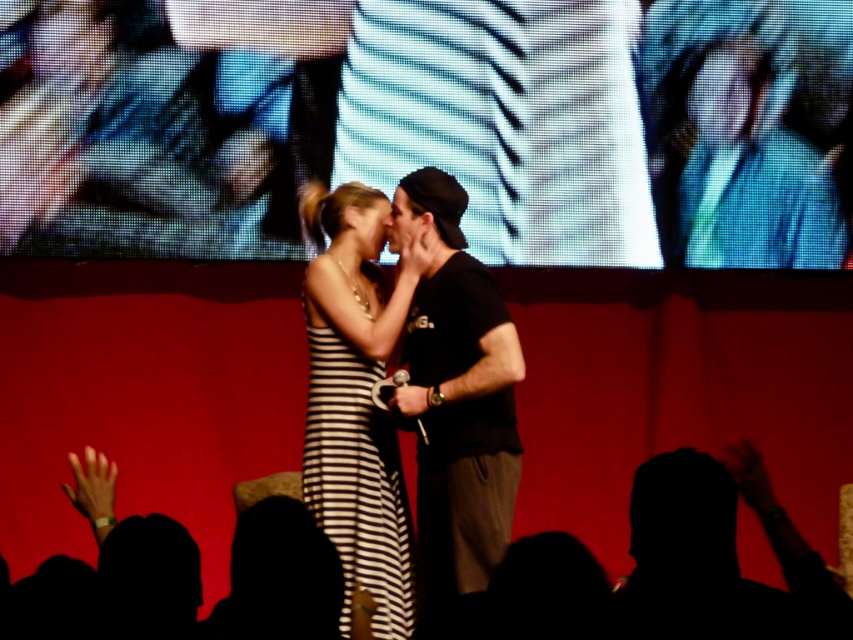
Between black cotton t-shirt at center and matte black hair at center, which one appears on the left side from the viewer's perspective?

matte black hair at center

Is black cotton t-shirt at center closer to the viewer compared to matte black hair at center?

That is True.

Does point (456, 376) come behind point (424, 221)?

No, (456, 376) is in front of (424, 221).

What are the coordinates of `black cotton t-shirt at center` in the screenshot? It's located at (457, 403).

Identify the location of matte black face at center. tap(369, 227).

Between matte black face at center and matte black hair at center, which one appears on the left side from the viewer's perspective?

Positioned to the left is matte black face at center.

Identify the location of matte black face at center. (369, 227).

Image resolution: width=853 pixels, height=640 pixels. In order to click on matte black face at center in this screenshot , I will do `click(369, 227)`.

Does blue fabric at upper center have a lesser width compared to matte black face at center?

No.

What do you see at coordinates (753, 152) in the screenshot?
I see `blue fabric at upper center` at bounding box center [753, 152].

Is point (734, 168) closer to viewer compared to point (380, 250)?

No, (734, 168) is behind (380, 250).

This screenshot has width=853, height=640. In order to click on blue fabric at upper center in this screenshot , I will do `click(753, 152)`.